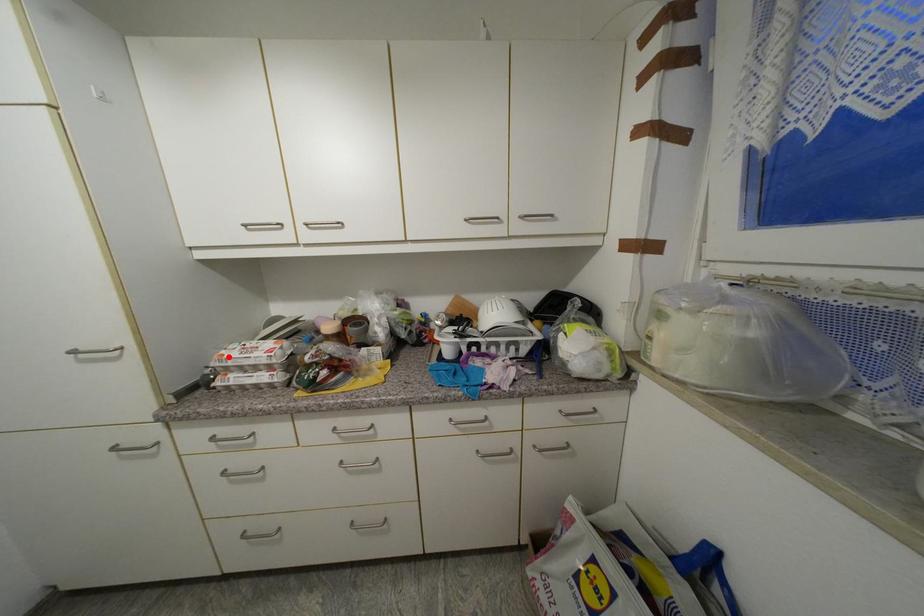
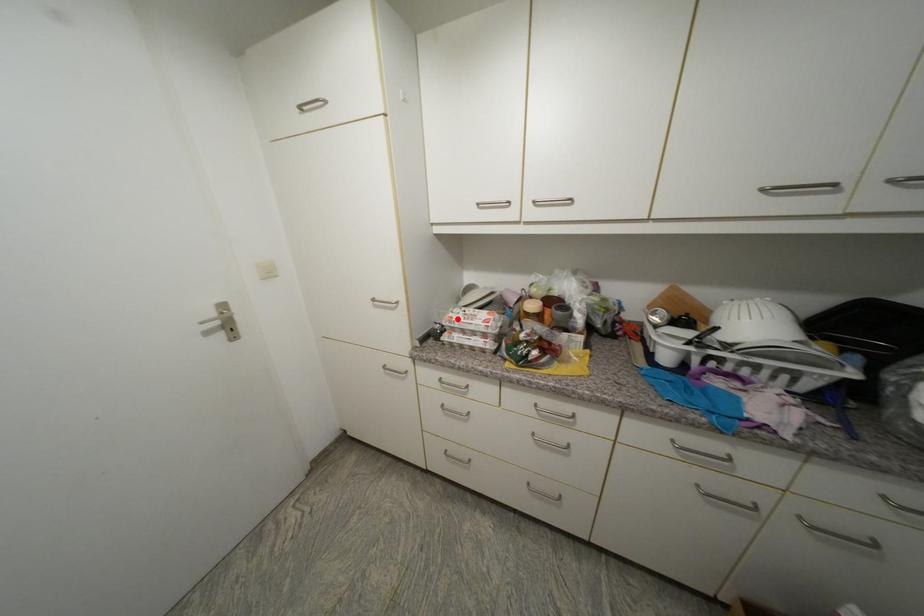
I am providing you with two images of the same scene from different viewpoints. A red point is marked on the first image and another point is marked on the second image. Are the points marked in image1 and image2 representing the same 3D position?

Yes